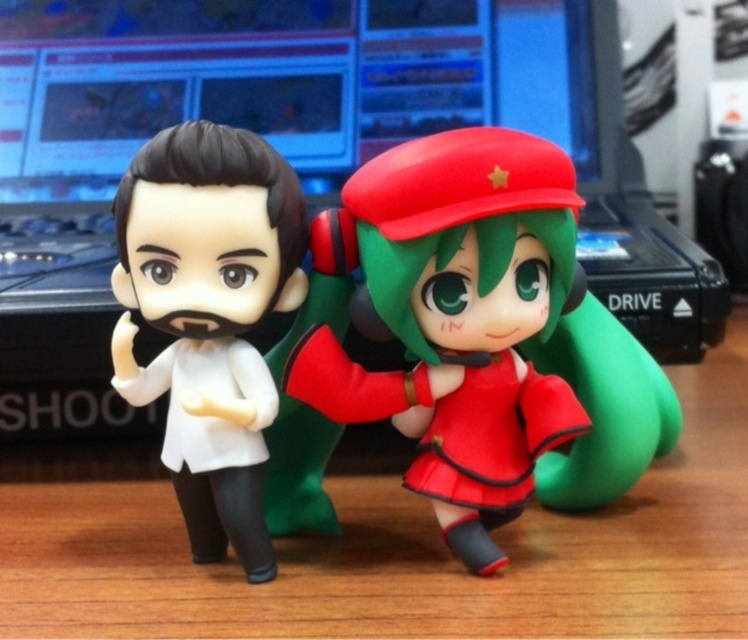
Question: Does wooden table at center have a larger size compared to rubberized red figure at center?

Choices:
 (A) yes
 (B) no

Answer: (A)

Question: Which point is farther to the camera?

Choices:
 (A) (220, 460)
 (B) (548, 195)

Answer: (A)

Question: Does wooden table at center have a smaller size compared to rubberized red figure at center?

Choices:
 (A) no
 (B) yes

Answer: (A)

Question: Among these points, which one is nearest to the camera?

Choices:
 (A) (561, 202)
 (B) (269, 292)
 (C) (4, 465)

Answer: (A)

Question: Can you confirm if wooden table at center is positioned to the left of rubberized red figure at center?

Choices:
 (A) yes
 (B) no

Answer: (B)

Question: Which point is closer to the camera?

Choices:
 (A) rubberized red figure at center
 (B) wooden table at center

Answer: (B)